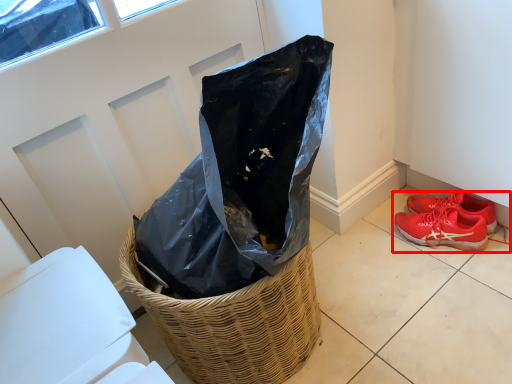
Question: From the image's perspective, where is footwear (annotated by the red box) located relative to basket?

Choices:
 (A) above
 (B) below

Answer: (A)